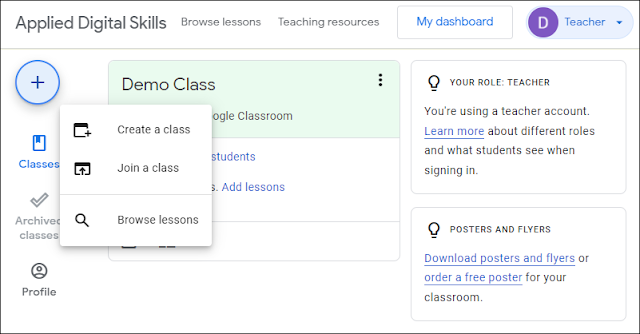
The image size is (640, 334). What are the coordinates of `light bulb` in the screenshot? It's located at (429, 229).